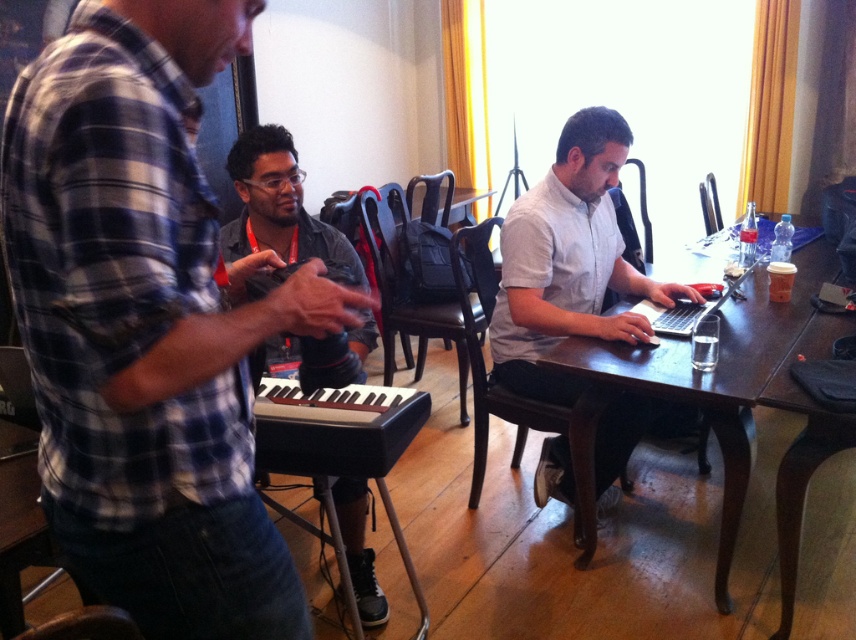
Is white matte shirt at center bigger than brown wooden table at center?

No.

How distant is white matte shirt at center from brown wooden table at center?

11.73 inches

Is point (595, 317) less distant than point (716, 602)?

No, (595, 317) is further to viewer.

Find the location of a particular element. white matte shirt at center is located at coordinates (568, 260).

Which of these two, matte black keyboard at center or silver metallic laptop at center, stands taller?

With more height is matte black keyboard at center.

Which is behind, point (357, 532) or point (655, 324)?

Point (357, 532)

You are a GUI agent. You are given a task and a screenshot of the screen. Output one action in this format:
    pyautogui.click(x=<x>, y=<y>)
    Task: Click on the matte black keyboard at center
    This screenshot has width=856, height=640.
    Given the screenshot: What is the action you would take?
    pyautogui.click(x=278, y=205)

Does black leather piano at center have a lesser width compared to silver metallic laptop at center?

Indeed, black leather piano at center has a lesser width compared to silver metallic laptop at center.

Is black leather piano at center to the right of silver metallic laptop at center from the viewer's perspective?

In fact, black leather piano at center is to the left of silver metallic laptop at center.

Locate an element on the screen. This screenshot has height=640, width=856. black leather piano at center is located at coordinates click(x=336, y=429).

Identify the location of black leather piano at center. The height and width of the screenshot is (640, 856). (336, 429).